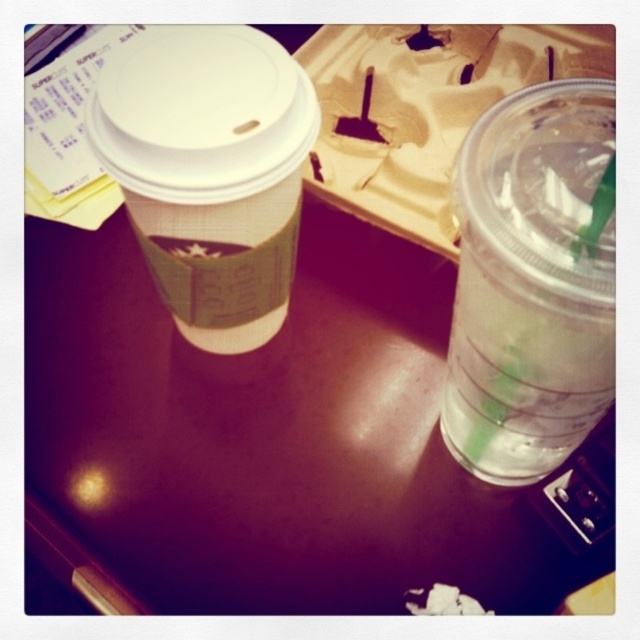
You are a delivery person who needs to hand over the clear plastic cup at right to a customer standing in front of you. Can you reach it without moving the brown paper cup at upper left?

The clear plastic cup at right is closer to the viewer than the brown paper cup at upper left, so yes, you can reach it without moving the brown paper cup at upper left.

You are at a cafe and want to choose a beverage. You see a clear plastic cup at right and a brown paper cup at upper left. Which cup can hold more liquid?

The clear plastic cup at right is larger in size than the brown paper cup at upper left, so it can hold more liquid.

You are holding a smartphone that is 15 centimeters long. You want to take a closeup photo of the clear plastic cup at right. Can you hold your phone so that the entire cup fits in the frame without moving the cup?

The clear plastic cup at right is 21.08 centimeters away from viewer. Since the phone is 15 centimeters long, which is shorter than the distance to the cup, you can move the phone closer to the cup until the entire cup fits in the frame.